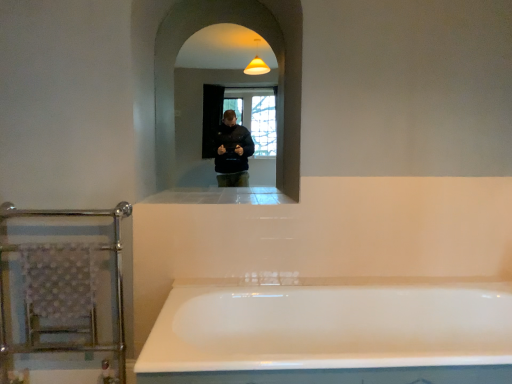
Question: Considering the relative positions of white glossy bathtub at center and chrome metallic towel rack at left in the image provided, is white glossy bathtub at center to the left or to the right of chrome metallic towel rack at left?

Choices:
 (A) right
 (B) left

Answer: (A)

Question: Do you think white glossy bathtub at center is within chrome metallic towel rack at left, or outside of it?

Choices:
 (A) outside
 (B) inside

Answer: (A)

Question: Estimate the real-world distances between objects in this image. Which object is farther from the clear glass mirror at center?

Choices:
 (A) chrome metallic towel rack at left
 (B) white glossy ledge at center
 (C) white glossy bathtub at center

Answer: (C)

Question: Based on their relative distances, which object is farther from the white glossy bathtub at center?

Choices:
 (A) white glossy ledge at center
 (B) clear glass mirror at center
 (C) chrome metallic towel rack at left

Answer: (B)